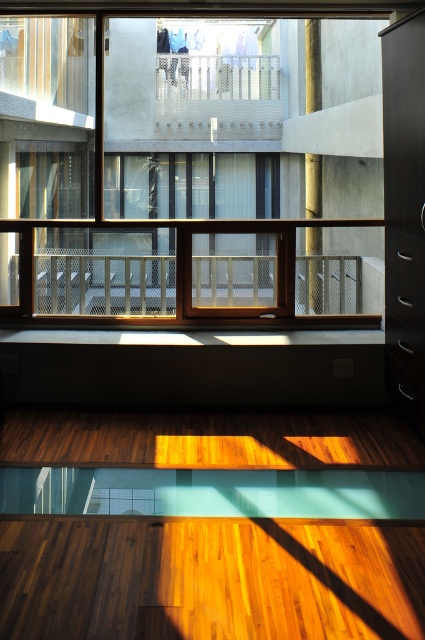
In the scene shown: Which is below, metallic mesh balcony at center or gold textured pillar at center?

metallic mesh balcony at center is lower down.

Which is above, metallic mesh balcony at center or gold textured pillar at center?

gold textured pillar at center

Who is more forward, (190, 269) or (316, 248)?

Point (190, 269)

You are a GUI agent. You are given a task and a screenshot of the screen. Output one action in this format:
    pyautogui.click(x=<x>, y=<y>)
    Task: Click on the metallic mesh balcony at center
    Image resolution: width=425 pixels, height=640 pixels.
    Given the screenshot: What is the action you would take?
    pyautogui.click(x=195, y=276)

Which of these two, clear glass window at center or metallic mesh balcony at center, stands shorter?

With less height is metallic mesh balcony at center.

Is clear glass window at center further to camera compared to metallic mesh balcony at center?

No, clear glass window at center is closer to the viewer.

Is point (377, 298) closer to camera compared to point (368, 316)?

No, it is behind (368, 316).

This screenshot has height=640, width=425. In order to click on clear glass window at center in this screenshot , I will do `click(218, 179)`.

Between clear glass window at center and gold textured pillar at center, which one has more height?

clear glass window at center

Is clear glass window at center smaller than gold textured pillar at center?

Incorrect, clear glass window at center is not smaller in size than gold textured pillar at center.

Which is behind, point (336, 269) or point (320, 289)?

The point (320, 289) is behind.

Identify the location of clear glass window at center. (218, 179).